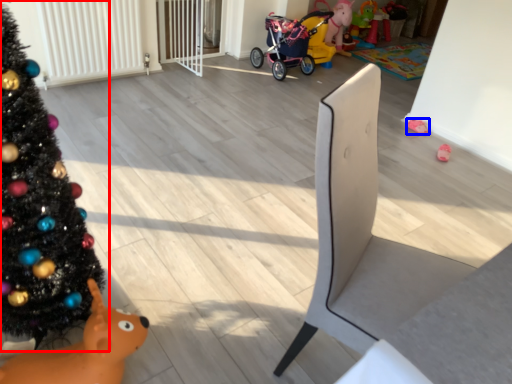
Question: Among these objects, which one is nearest to the camera, christmas tree (highlighted by a red box) or toy (highlighted by a blue box)?

Choices:
 (A) christmas tree
 (B) toy

Answer: (A)